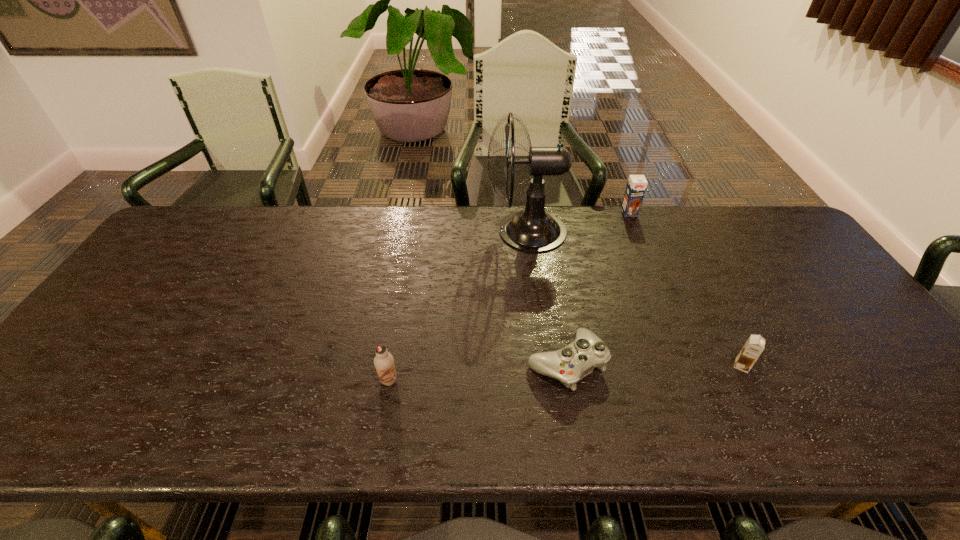
Select which object appears as the closest to the leftmost chocolate milk. Please provide its 2D coordinates. Your answer should be formatted as a tuple, i.e. [(x, y)], where the tuple contains the x and y coordinates of a point satisfying the conditions above.

[(570, 364)]

Identify which object is the second nearest to the farthest chocolate milk. Please provide its 2D coordinates. Your answer should be formatted as a tuple, i.e. [(x, y)], where the tuple contains the x and y coordinates of a point satisfying the conditions above.

[(570, 364)]

Choose which chocolate milk is the third nearest neighbor to the control. Please provide its 2D coordinates. Your answer should be formatted as a tuple, i.e. [(x, y)], where the tuple contains the x and y coordinates of a point satisfying the conditions above.

[(636, 186)]

Select which chocolate milk is the third closest to the tallest object. Please provide its 2D coordinates. Your answer should be formatted as a tuple, i.e. [(x, y)], where the tuple contains the x and y coordinates of a point satisfying the conditions above.

[(754, 346)]

Identify the location of vacant space that satisfies the following two spatial constraints: 1. on the back side of the rightmost object; 2. on the right side of the leftmost object. 391,366.

Where is `free region that satisfies the following two spatial constraints: 1. on the back side of the rightmost object; 2. on the front-facing side of the fan`? The image size is (960, 540). free region that satisfies the following two spatial constraints: 1. on the back side of the rightmost object; 2. on the front-facing side of the fan is located at coordinates (673, 231).

You are a GUI agent. You are given a task and a screenshot of the screen. Output one action in this format:
    pyautogui.click(x=<x>, y=<y>)
    Task: Click on the vacant space that satisfies the following two spatial constraints: 1. on the front-facing side of the fan; 2. on the front side of the second shortest chocolate milk
    Image resolution: width=960 pixels, height=540 pixels.
    Given the screenshot: What is the action you would take?
    pyautogui.click(x=545, y=380)

Find the location of a particular element. vacant space that satisfies the following two spatial constraints: 1. on the back side of the rightmost chocolate milk; 2. on the front-facing side of the tallest object is located at coordinates (673, 231).